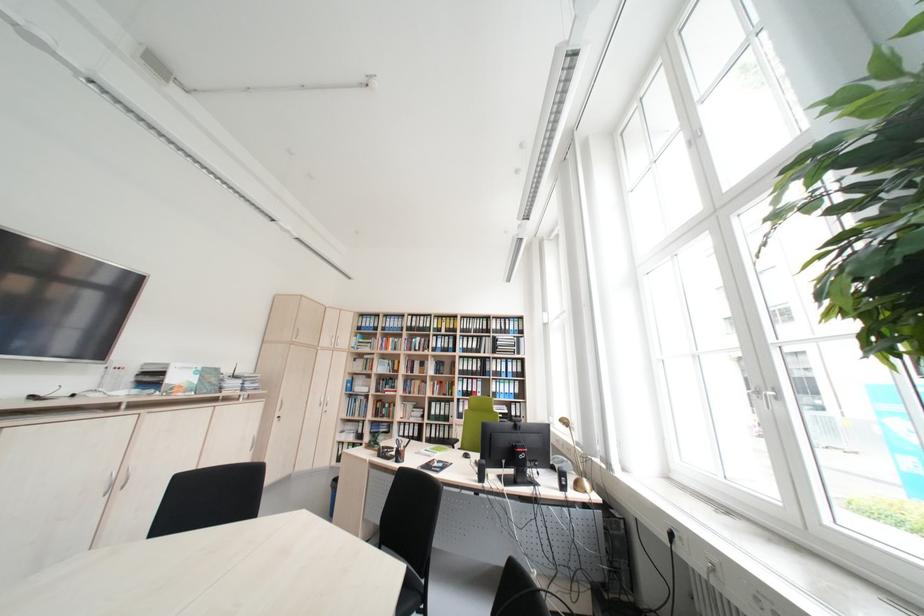
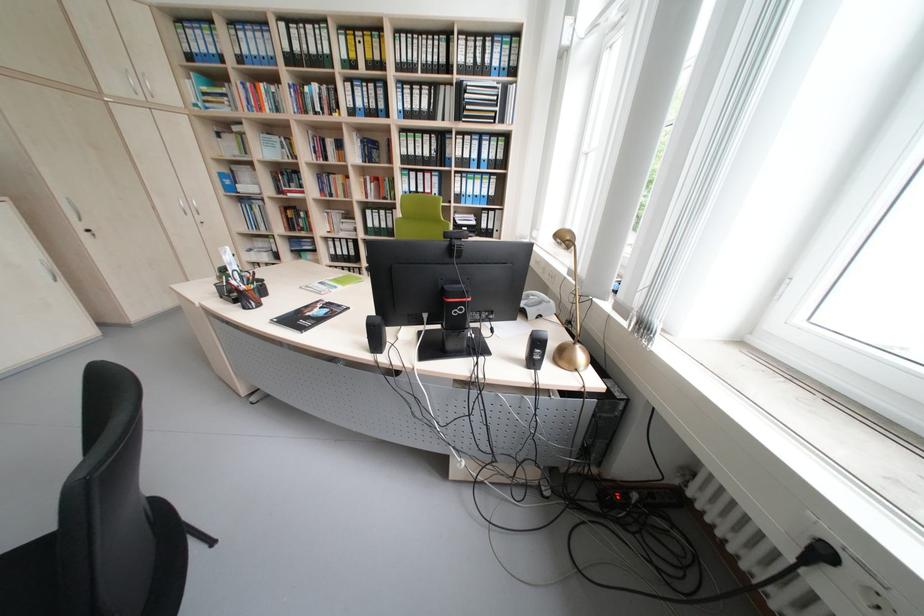
The point at (286, 421) is marked in the first image. Where is the corresponding point in the second image?

(93, 236)